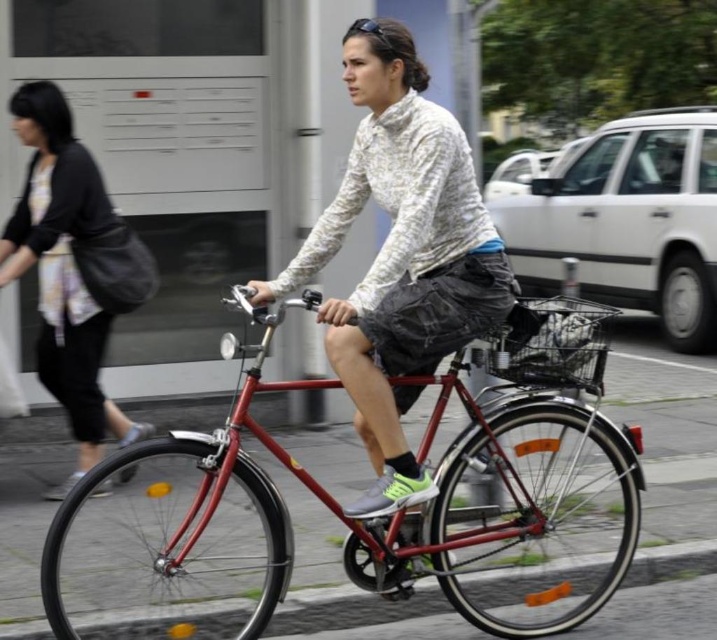
You are a delivery person trying to pass through a narrow alley. You see the metallic red bicycle at center and the white textured shirt at center. Based on their widths, can you determine if the bicycle will fit through the alley if the shirt just barely fits?

The metallic red bicycle at center might be wider than white textured shirt at center, so if the shirt just barely fits through the alley, the bicycle might not fit.

You are a photographer trying to capture the cyclist in the scene. Since the metallic red bicycle at center and the white textured shirt at center are both in focus, which one should you zoom in on to ensure the bicycle is the main subject?

The metallic red bicycle at center is larger in size than the white textured shirt at center, so zooming in on the metallic red bicycle at center will make it the main subject as it already occupies more visual space.